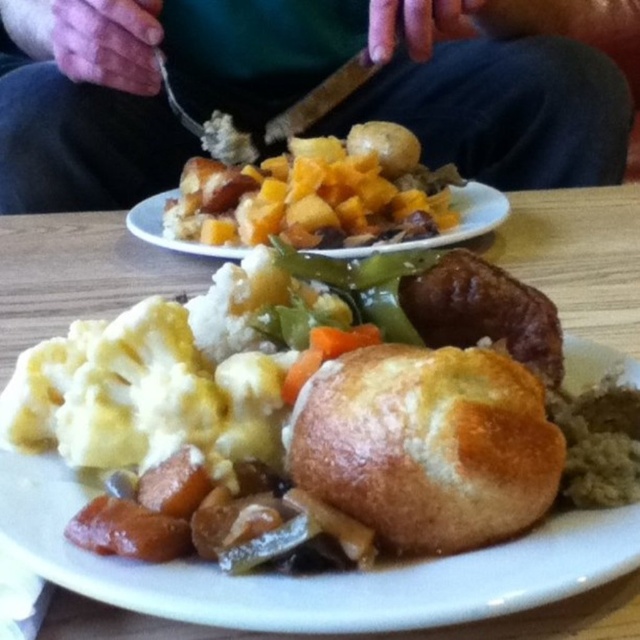
Measure the distance between point (67, 282) and camera.

They are 32.51 inches apart.

Between golden brown bread roll at center and golden brown crusty bread at center, which one is positioned lower?

golden brown crusty bread at center

Identify the location of golden brown bread roll at center. (77, 275).

Between green fabric shirt at upper center and golden brown crumbly pastry at center, which one has less height?

With less height is golden brown crumbly pastry at center.

Can you confirm if green fabric shirt at upper center is taller than golden brown crumbly pastry at center?

Indeed, green fabric shirt at upper center has a greater height compared to golden brown crumbly pastry at center.

Does point (186, 49) come behind point (170, 236)?

Yes, point (186, 49) is farther from viewer.

This screenshot has width=640, height=640. I want to click on green fabric shirt at upper center, so (x=308, y=86).

Is point (186, 200) less distant than point (346, 252)?

No, (186, 200) is behind (346, 252).

Locate an element on the screen. The width and height of the screenshot is (640, 640). golden brown croutons at center is located at coordinates (317, 195).